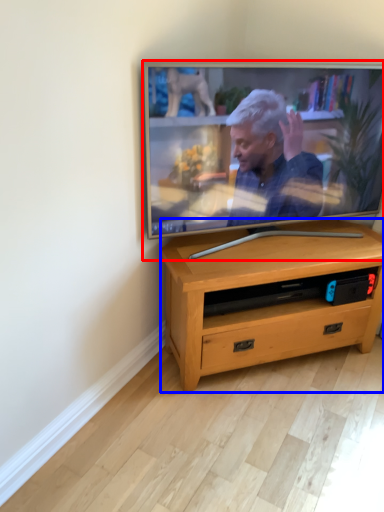
Question: Which object appears farthest to the camera in this image, television (highlighted by a red box) or desk (highlighted by a blue box)?

Choices:
 (A) television
 (B) desk

Answer: (B)